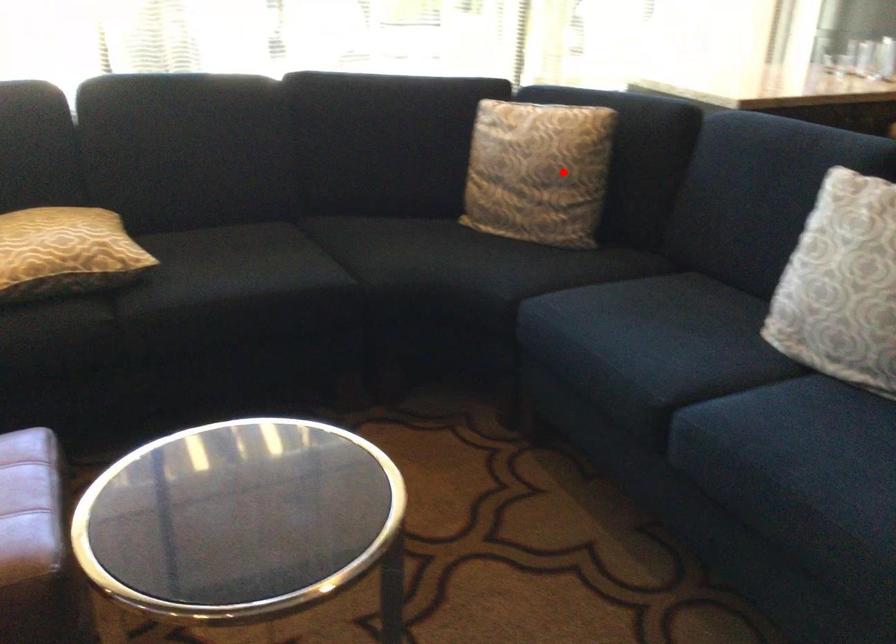
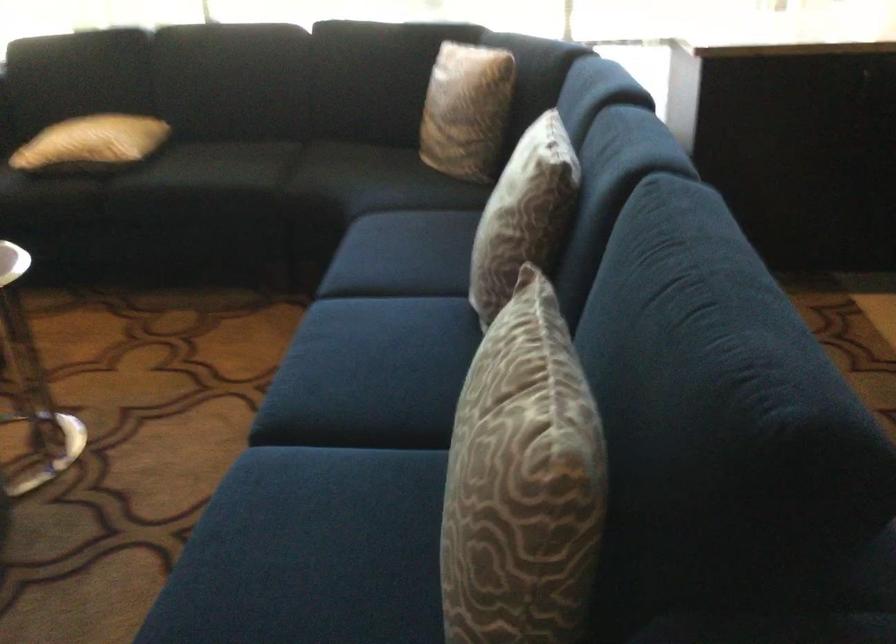
Question: I am providing you with two images of the same scene from different viewpoints. A red point is shown in image1. For the corresponding object point in image2, is it positioned nearer or farther from the camera?

Choices:
 (A) Nearer
 (B) Farther

Answer: (B)